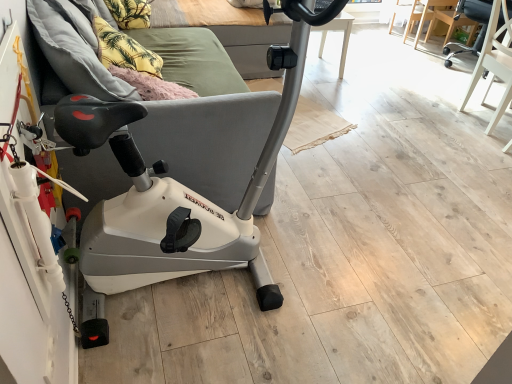
Image resolution: width=512 pixels, height=384 pixels. Identify the location of light brown wooden chair at upper right, the 1th chair from the left. (403, 13).

What do you see at coordinates (425, 16) in the screenshot? The image size is (512, 384). I see `wooden table at center` at bounding box center [425, 16].

The width and height of the screenshot is (512, 384). What are the coordinates of `white plastic stationary bicycle at left` in the screenshot? It's located at (192, 201).

Describe the element at coordinates (450, 22) in the screenshot. Image resolution: width=512 pixels, height=384 pixels. I see `matte black chair at upper right, which is the second chair in left-to-right order` at that location.

Where is `black leather swivel chair at upper right, placed as the 1th swivel chair when sorted from back to front`? black leather swivel chair at upper right, placed as the 1th swivel chair when sorted from back to front is located at coordinates (473, 20).

At what (x,y) coordinates should I click in order to perform the action: click on yellow fabric pillow at upper left, the first pillow when ordered from top to bottom. Please return your answer as a coordinate pair (x, y). Looking at the image, I should click on tap(130, 13).

From the picture: Is the surface of white plastic stationary bicycle at left in direct contact with light brown wooden chair at upper right, which is counted as the 2th chair, starting from the right?

No, white plastic stationary bicycle at left is not beside light brown wooden chair at upper right, which is counted as the 2th chair, starting from the right.

Is white plastic stationary bicycle at left smaller than light brown wooden chair at upper right, which is counted as the 2th chair, starting from the right?

No, white plastic stationary bicycle at left is not smaller than light brown wooden chair at upper right, which is counted as the 2th chair, starting from the right.

Which point is more distant from viewer, (x=117, y=205) or (x=397, y=0)?

The point (x=397, y=0) is more distant.

Who is smaller, yellow fabric pillow at upper left, the first pillow when ordered from top to bottom, or wooden table at center?

Smaller between the two is yellow fabric pillow at upper left, the first pillow when ordered from top to bottom.

From the image's perspective, relative to wooden table at center, is yellow fabric pillow at upper left, acting as the 2th pillow starting from the bottom, above or below?

From the image's perspective, yellow fabric pillow at upper left, acting as the 2th pillow starting from the bottom, appears below wooden table at center.

Between yellow fabric pillow at upper left, the first pillow when ordered from top to bottom, and wooden table at center, which one appears on the left side from the viewer's perspective?

yellow fabric pillow at upper left, the first pillow when ordered from top to bottom, is more to the left.

In order to click on the 1st pillow to the left of the black leather swivel chair at upper right, marked as the first swivel chair in a front-to-back arrangement, starting your count from the anchor in this screenshot , I will do `click(124, 50)`.

Is yellow fabric pillow at upper left, the first pillow when ordered from bottom to top, thinner than black leather swivel chair at upper right, marked as the first swivel chair in a front-to-back arrangement?

Yes, yellow fabric pillow at upper left, the first pillow when ordered from bottom to top, is thinner than black leather swivel chair at upper right, marked as the first swivel chair in a front-to-back arrangement.

Based on the photo, from a real-world perspective, who is located higher, yellow fabric pillow at upper left, which appears as the first pillow when viewed from the front, or black leather swivel chair at upper right, marked as the first swivel chair in a front-to-back arrangement?

From a 3D spatial view, yellow fabric pillow at upper left, which appears as the first pillow when viewed from the front, is above.

From a real-world perspective, is black leather swivel chair at upper right, marked as the first swivel chair in a front-to-back arrangement, beneath wooden table at center?

No, from a real-world perspective, black leather swivel chair at upper right, marked as the first swivel chair in a front-to-back arrangement, is not under wooden table at center.

Is black leather swivel chair at upper right, which is the 2th swivel chair in back-to-front order, bigger or smaller than wooden table at center?

black leather swivel chair at upper right, which is the 2th swivel chair in back-to-front order, is bigger than wooden table at center.

Which is behind, point (487, 33) or point (422, 6)?

Point (422, 6)

Is yellow fabric pillow at upper left, the first pillow when ordered from bottom to top, a part of light brown wooden chair at upper right, the 1th chair from the left?

That's incorrect, yellow fabric pillow at upper left, the first pillow when ordered from bottom to top, is not inside light brown wooden chair at upper right, the 1th chair from the left.

From the image's perspective, is light brown wooden chair at upper right, which is counted as the 2th chair, starting from the right, located beneath yellow fabric pillow at upper left, the first pillow when ordered from bottom to top?

No, from the image's perspective, light brown wooden chair at upper right, which is counted as the 2th chair, starting from the right, is not below yellow fabric pillow at upper left, the first pillow when ordered from bottom to top.

Does light brown wooden chair at upper right, which is counted as the 2th chair, starting from the right, have a smaller size compared to yellow fabric pillow at upper left, the first pillow when ordered from bottom to top?

Yes, light brown wooden chair at upper right, which is counted as the 2th chair, starting from the right, is smaller than yellow fabric pillow at upper left, the first pillow when ordered from bottom to top.

Which is more to the left, light brown wooden chair at upper right, the 1th chair from the left, or yellow fabric pillow at upper left, positioned as the 2th pillow in back-to-front order?

yellow fabric pillow at upper left, positioned as the 2th pillow in back-to-front order.

Considering the relative sizes of wooden table at center and white plastic stationary bicycle at left in the image provided, is wooden table at center bigger than white plastic stationary bicycle at left?

No.

Which is behind, point (424, 9) or point (144, 179)?

Point (424, 9)

Identify the location of table behind the white plastic stationary bicycle at left. This screenshot has width=512, height=384. (425, 16).

Does wooden table at center contain white plastic stationary bicycle at left?

No.

Would you consider wooden table at center to be distant from matte black chair at upper right, the 1th chair when ordered from right to left?

They are positioned close to each other.

Can you confirm if wooden table at center is shorter than matte black chair at upper right, which is the second chair in left-to-right order?

Yes, wooden table at center is shorter than matte black chair at upper right, which is the second chair in left-to-right order.

Is matte black chair at upper right, which is the second chair in left-to-right order, completely or partially inside wooden table at center?

Yes, matte black chair at upper right, which is the second chair in left-to-right order, is inside wooden table at center.

Is point (439, 7) in front of point (467, 39)?

Yes, it is.

Where is `stationary bicycle located above the light brown wooden chair at upper right, the 1th chair from the left (from a real-world perspective)`? The image size is (512, 384). stationary bicycle located above the light brown wooden chair at upper right, the 1th chair from the left (from a real-world perspective) is located at coordinates (192, 201).

What are the coordinates of `the 1st pillow in front when counting from the wooden table at center` in the screenshot? It's located at (130, 13).

From the picture: From the image, which object appears to be nearer to light brown wooden chair at upper right, the 1th chair from the left, matte black chair at upper right, which is the second chair in left-to-right order, or yellow fabric pillow at upper left, the 2th pillow when ordered from front to back?

matte black chair at upper right, which is the second chair in left-to-right order, is positioned closer to the anchor light brown wooden chair at upper right, the 1th chair from the left.

Estimate the real-world distances between objects in this image. Which object is further from yellow fabric pillow at upper left, which appears as the first pillow when viewed from the front, light brown wooden chair at upper right, the 1th chair from the left, or black leather swivel chair at upper right, which is the 2th swivel chair in back-to-front order?

Among the two, light brown wooden chair at upper right, the 1th chair from the left, is located further to yellow fabric pillow at upper left, which appears as the first pillow when viewed from the front.

Looking at the image, which one is located closer to matte black chair at upper right, which is the second chair in left-to-right order, black leather swivel chair at upper right, acting as the second swivel chair starting from the front, or white plastic stationary bicycle at left?

Among the two, black leather swivel chair at upper right, acting as the second swivel chair starting from the front, is located nearer to matte black chair at upper right, which is the second chair in left-to-right order.

When comparing their distances from white plastic stationary bicycle at left, does yellow fabric pillow at upper left, which appears as the 1th pillow when viewed from the back, or black leather swivel chair at upper right, placed as the 1th swivel chair when sorted from back to front, seem closer?

yellow fabric pillow at upper left, which appears as the 1th pillow when viewed from the back, is closer to white plastic stationary bicycle at left.

When comparing their distances from white plastic stationary bicycle at left, does yellow fabric pillow at upper left, positioned as the 2th pillow in back-to-front order, or light brown wooden chair at upper right, the 1th chair from the left, seem further?

light brown wooden chair at upper right, the 1th chair from the left.

Estimate the real-world distances between objects in this image. Which object is closer to wooden table at center, yellow fabric pillow at upper left, the first pillow when ordered from bottom to top, or black leather swivel chair at upper right, acting as the second swivel chair starting from the front?

black leather swivel chair at upper right, acting as the second swivel chair starting from the front, is closer to wooden table at center.

Which object lies nearer to the anchor point matte black chair at upper right, the 1th chair when ordered from right to left, black leather swivel chair at upper right, acting as the second swivel chair starting from the front, or light brown wooden chair at upper right, the 1th chair from the left?

black leather swivel chair at upper right, acting as the second swivel chair starting from the front, is closer to matte black chair at upper right, the 1th chair when ordered from right to left.

Which object lies nearer to the anchor point black leather swivel chair at upper right, which is the 2th swivel chair in back-to-front order, yellow fabric pillow at upper left, which appears as the 2th pillow when viewed from the top, or black leather swivel chair at upper right, placed as the 1th swivel chair when sorted from back to front?

black leather swivel chair at upper right, placed as the 1th swivel chair when sorted from back to front, lies closer to black leather swivel chair at upper right, which is the 2th swivel chair in back-to-front order, than the other object.

Locate an element on the screen. Image resolution: width=512 pixels, height=384 pixels. chair between white plastic stationary bicycle at left and light brown wooden chair at upper right, which is counted as the 2th chair, starting from the right, along the z-axis is located at coordinates (450, 22).

Locate an element on the screen. pillow between yellow fabric pillow at upper left, acting as the 2th pillow starting from the bottom, and light brown wooden chair at upper right, the 1th chair from the left is located at coordinates (124, 50).

The image size is (512, 384). What are the coordinates of `pillow located between yellow fabric pillow at upper left, the first pillow when ordered from top to bottom, and black leather swivel chair at upper right, which is the 2th swivel chair in back-to-front order, in the left-right direction` in the screenshot? It's located at (124, 50).

Where is `table between black leather swivel chair at upper right, acting as the second swivel chair starting from the front, and light brown wooden chair at upper right, the 1th chair from the left, in the front-back direction`? table between black leather swivel chair at upper right, acting as the second swivel chair starting from the front, and light brown wooden chair at upper right, the 1th chair from the left, in the front-back direction is located at coordinates (425, 16).